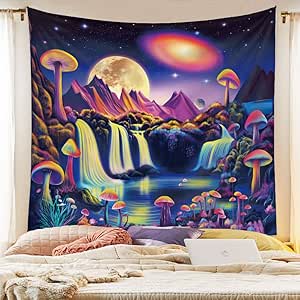
I want to click on tapestry, so click(x=233, y=131).